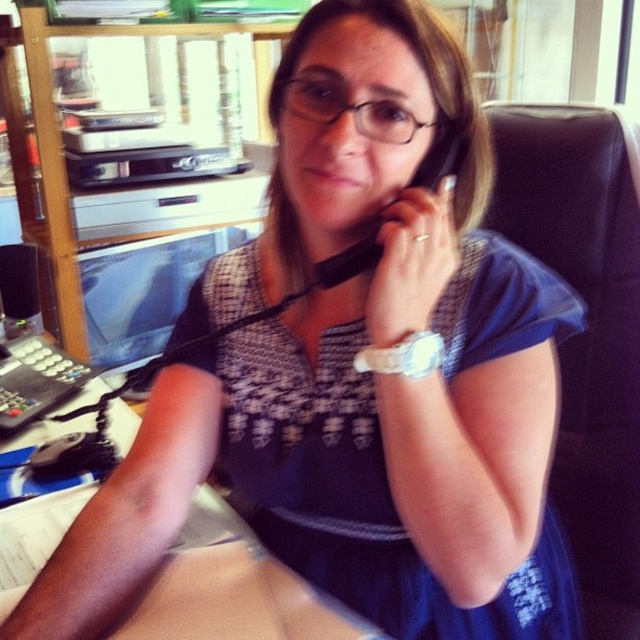
You are standing in the office and want to reach the point at coordinates point [353,561]. If you can stretch your hand 30 inches forward, will you be able to reach it?

The point [353,561] is 28.81 inches from the viewer. Since your hand can stretch 30 inches forward, you can reach it.

You are an office worker who needs to sit down. You see the blue woven dress at center and the black leather chair at right. Which object is suitable for sitting?

The black leather chair at right is suitable for sitting, as the blue woven dress at center is positioned under it and likely belongs to the woman in the scene, not a seating option.

You are a delivery person who needs to place a small package on the desk without disturbing the woman. The package is 12 inches wide. Can you fit it between the black leather chair at right and the wooden table at lower center?

The black leather chair at right and wooden table at lower center are 22.85 inches apart from each other. Since the package is 12 inches wide, which is less than the 22.85 inches gap, you can fit the package between them without disturbing the woman.